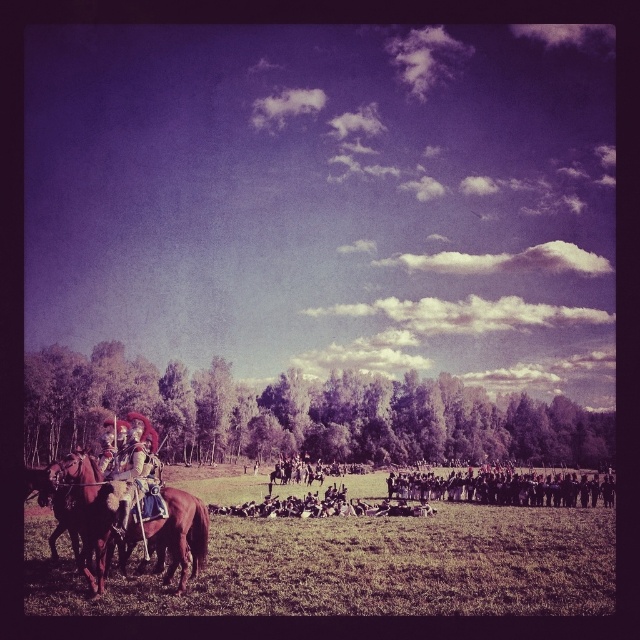
You are a photographer trying to capture a closeup of the shiny gold armor at left and the brown leather horse at lower left. Since you want to focus on the armor, which object should you move closer to in the scene?

The shiny gold armor at left is not as tall as the brown leather horse at lower left, so to focus on the armor, you should move closer to the shiny gold armor at left to ensure it fills the frame properly.

Looking at this image, you are a photographer standing at the point labeled point (205,534). You want to take a photo of the point labeled point (513,493) without any obstructions. Is there anything between you and your target point that might block the view?

Point (205,534) is in front of point (513,493), so there is nothing between you and the target point. You can take the photo without obstruction.